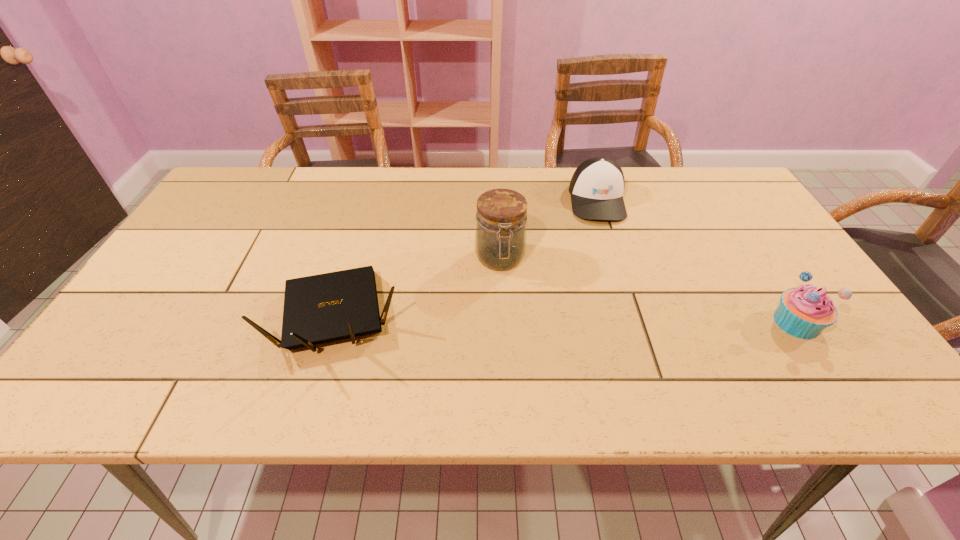
You are a GUI agent. You are given a task and a screenshot of the screen. Output one action in this format:
    pyautogui.click(x=<x>, y=<y>)
    Task: Click on the empty space between the farthest object and the muffin
    
    Given the screenshot: What is the action you would take?
    pyautogui.click(x=697, y=261)

You are a GUI agent. You are given a task and a screenshot of the screen. Output one action in this format:
    pyautogui.click(x=<x>, y=<y>)
    Task: Click on the free area in between the muffin and the cap
    This screenshot has height=540, width=960.
    Given the screenshot: What is the action you would take?
    pyautogui.click(x=697, y=261)

This screenshot has height=540, width=960. Identify the location of free spot between the cap and the leftmost object. (468, 258).

The width and height of the screenshot is (960, 540). What are the coordinates of `empty location between the leftmost object and the farthest object` in the screenshot? It's located at (468, 258).

Point out which object is positioned as the third nearest to the rightmost object. Please provide its 2D coordinates. Your answer should be formatted as a tuple, i.e. [(x, y)], where the tuple contains the x and y coordinates of a point satisfying the conditions above.

[(322, 308)]

Identify which object is the third nearest to the cap. Please provide its 2D coordinates. Your answer should be formatted as a tuple, i.e. [(x, y)], where the tuple contains the x and y coordinates of a point satisfying the conditions above.

[(322, 308)]

Locate an element on the screen. The height and width of the screenshot is (540, 960). vacant space that satisfies the following two spatial constraints: 1. on the front side of the jar; 2. on the right side of the muffin is located at coordinates (503, 322).

Identify the location of vacant region that satisfies the following two spatial constraints: 1. on the back side of the jar; 2. on the left side of the farthest object. (497, 200).

This screenshot has width=960, height=540. I want to click on vacant area in the image that satisfies the following two spatial constraints: 1. on the front side of the muffin; 2. on the right side of the second object from left to right, so click(x=503, y=322).

This screenshot has height=540, width=960. Find the location of `vacant space that satisfies the following two spatial constraints: 1. on the front side of the router; 2. on the right side of the rightmost object`. vacant space that satisfies the following two spatial constraints: 1. on the front side of the router; 2. on the right side of the rightmost object is located at coordinates (338, 322).